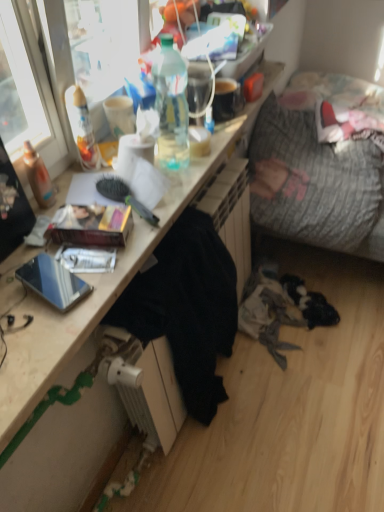
Question: Considering the positions of point click(x=99, y=159) and point click(x=122, y=408), is point click(x=99, y=159) closer or farther from the camera than point click(x=122, y=408)?

Choices:
 (A) closer
 (B) farther

Answer: (A)

Question: From a real-world perspective, is translucent plastic bottle at upper left, placed as the second bottle when sorted from right to left, above or below wooden desk at center?

Choices:
 (A) above
 (B) below

Answer: (A)

Question: Estimate the real-world distances between objects in this image. Which object is closer to the shiny metallic phone at lower left?

Choices:
 (A) matte cardboard book at center
 (B) translucent plastic bottle at upper center, acting as the 1th bottle starting from the right
 (C) wooden desk at center
 (D) textured gray fabric couch at right
 (E) translucent plastic bottle at upper left, the first bottle when ordered from left to right

Answer: (A)

Question: Estimate the real-world distances between objects in this image. Which object is closer to the textured gray fabric couch at right?

Choices:
 (A) wooden desk at center
 (B) matte cardboard book at center
 (C) translucent plastic bottle at upper left, the first bottle when ordered from left to right
 (D) shiny metallic phone at lower left
 (E) translucent plastic bottle at upper center, marked as the second bottle in a left-to-right arrangement

Answer: (E)